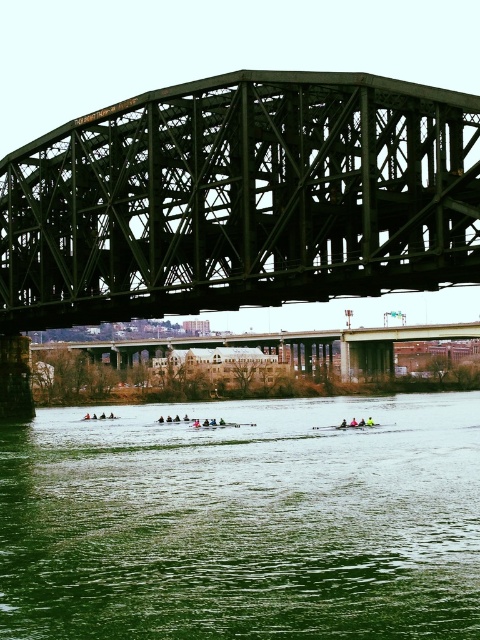
Question: Is green water at lower center bigger than green steel bridge at center?

Choices:
 (A) yes
 (B) no

Answer: (A)

Question: Which point appears farthest from the camera in this image?

Choices:
 (A) coord(23,579)
 (B) coord(327,332)
 (C) coord(63,268)

Answer: (B)

Question: Which object is the closest to the green metal bridge at upper center?

Choices:
 (A) green steel bridge at center
 (B) green water at lower center

Answer: (B)

Question: Considering the relative positions of green metal bridge at upper center and green steel bridge at center in the image provided, where is green metal bridge at upper center located with respect to green steel bridge at center?

Choices:
 (A) left
 (B) right

Answer: (A)

Question: Can you confirm if green water at lower center is smaller than green metal bridge at upper center?

Choices:
 (A) no
 (B) yes

Answer: (B)

Question: Which of the following is the closest to the observer?

Choices:
 (A) (396, 332)
 (B) (349, 532)

Answer: (B)